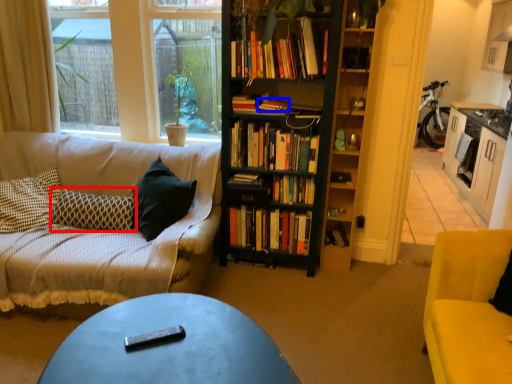
Question: Among these objects, which one is farthest to the camera, pillow (highlighted by a red box) or book (highlighted by a blue box)?

Choices:
 (A) pillow
 (B) book

Answer: (B)